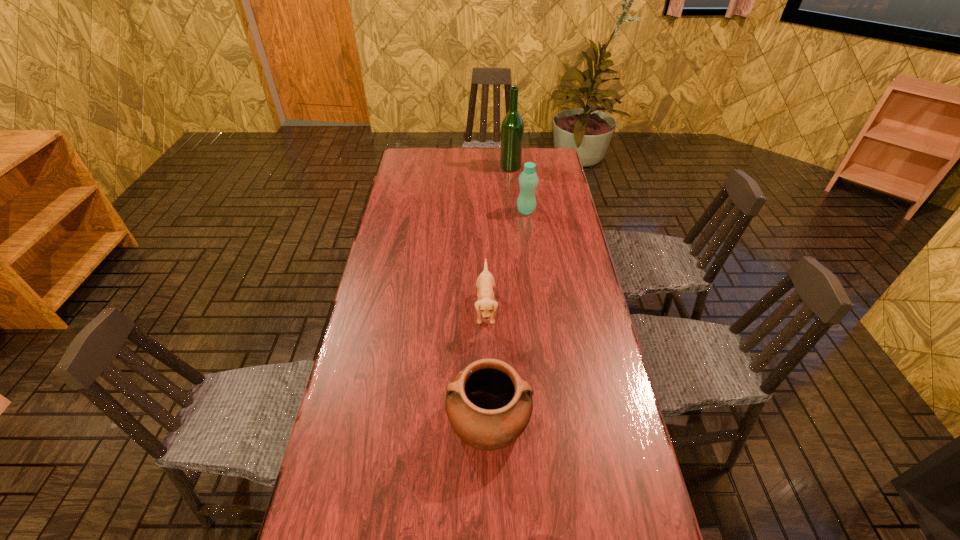
Where is `alcohol`? alcohol is located at coordinates (512, 127).

Identify the location of the tallest object. (512, 127).

Where is `the third nearest object`? The image size is (960, 540). the third nearest object is located at coordinates (528, 180).

Image resolution: width=960 pixels, height=540 pixels. I want to click on bottle, so click(x=528, y=180).

Find the location of `pottery`. pottery is located at coordinates (488, 403).

Image resolution: width=960 pixels, height=540 pixels. In order to click on the second shortest object in this screenshot , I will do `click(488, 403)`.

At what (x,y) coordinates should I click in order to perform the action: click on puppy. Please return your answer as a coordinate pair (x, y). This screenshot has width=960, height=540. Looking at the image, I should click on (486, 305).

Image resolution: width=960 pixels, height=540 pixels. What are the coordinates of `the third farthest object` in the screenshot? It's located at (486, 305).

Image resolution: width=960 pixels, height=540 pixels. Find the location of `free space located on the left of the farthest object`. free space located on the left of the farthest object is located at coordinates pos(468,167).

You are a GUI agent. You are given a task and a screenshot of the screen. Output one action in this format:
    pyautogui.click(x=<x>, y=<y>)
    Task: Click on the vacant space located on the front of the second tallest object
    The image size is (960, 540).
    Given the screenshot: What is the action you would take?
    pyautogui.click(x=528, y=226)